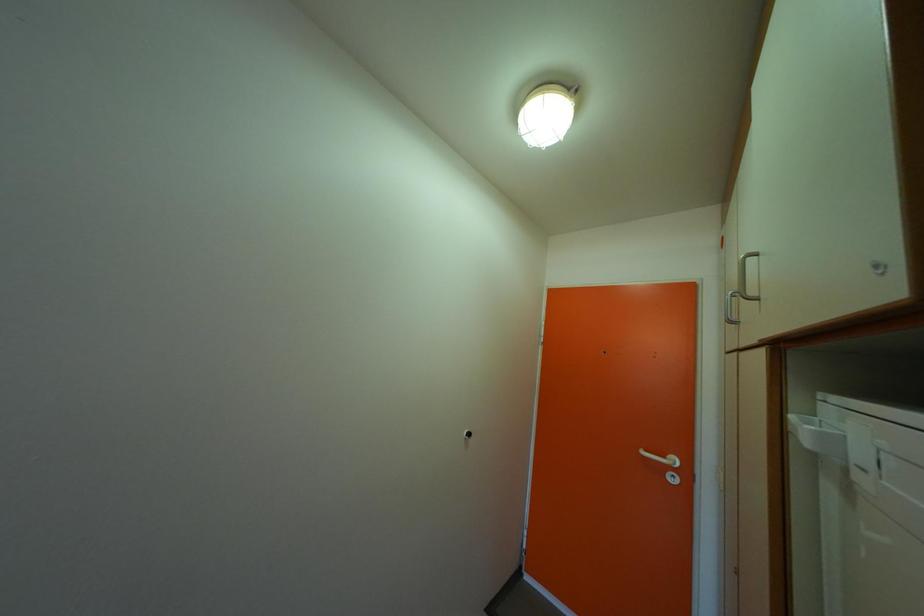
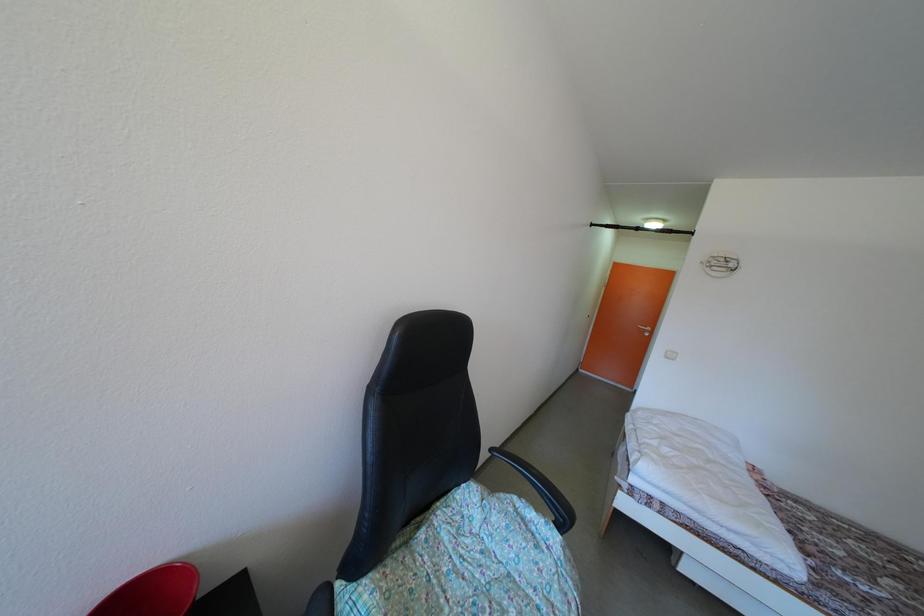
Which direction would the cameraman need to move to produce the second image?

The cameraman moved toward left, backward.